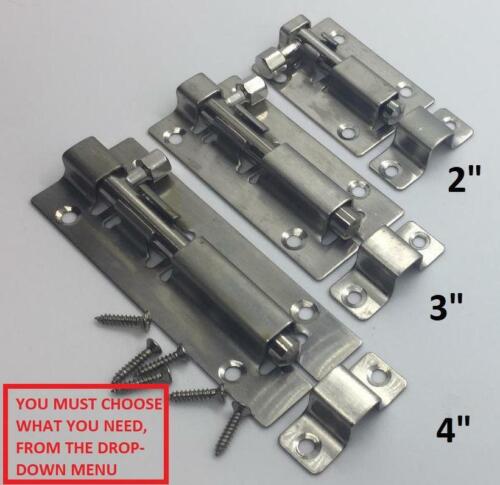
Identify the location of screw holes. (229, 372), (306, 308), (373, 369), (305, 447).